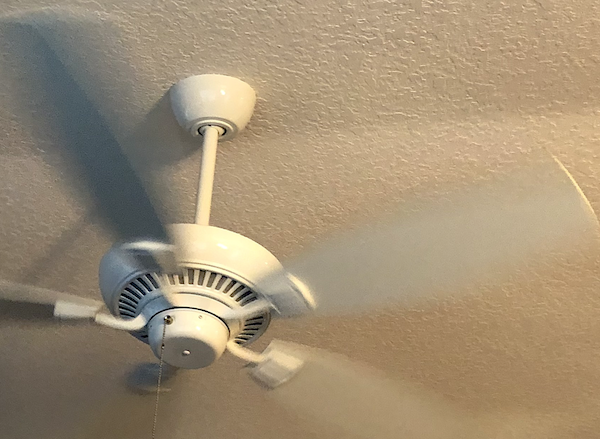
Please find where the chain comes out of the fan in the image and show me where they are. Your answer should be formatted as a list of tuples, i.e. [(x1, y1), (x2, y2), ...], where each tuple contains the x and y coordinates of a point satisfying the conditions above.

[(166, 317)]